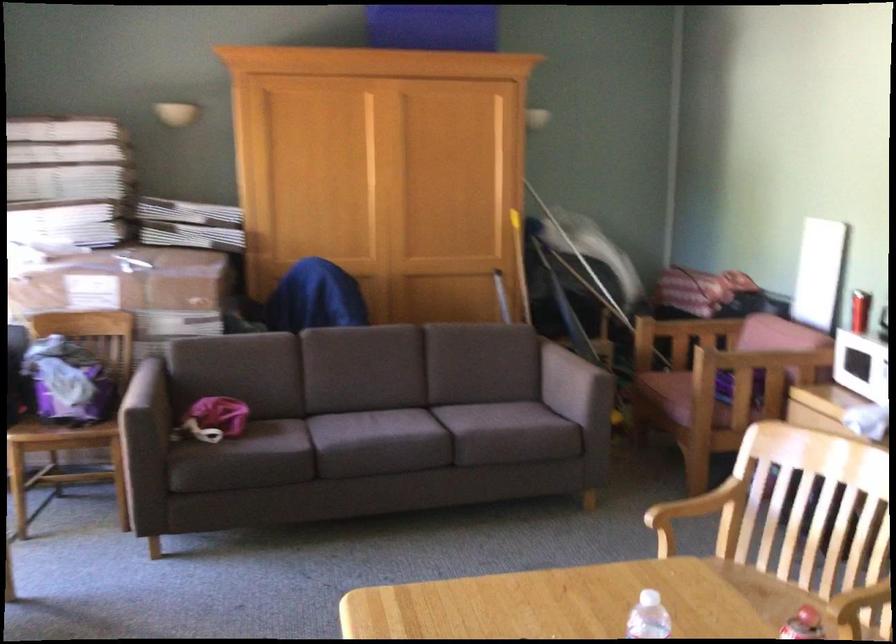
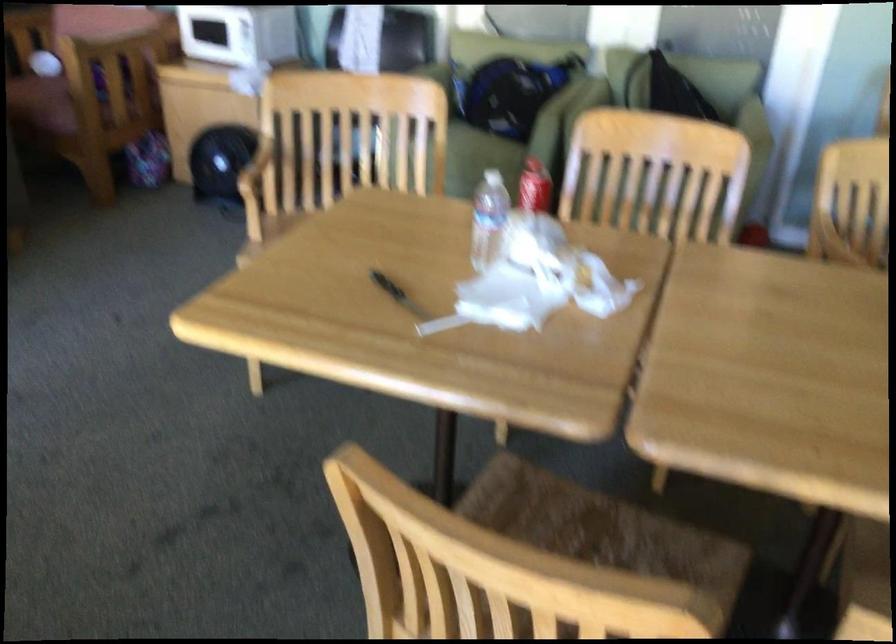
Where in the second image is the point corresponding to (x=705, y=504) from the first image?

(255, 166)